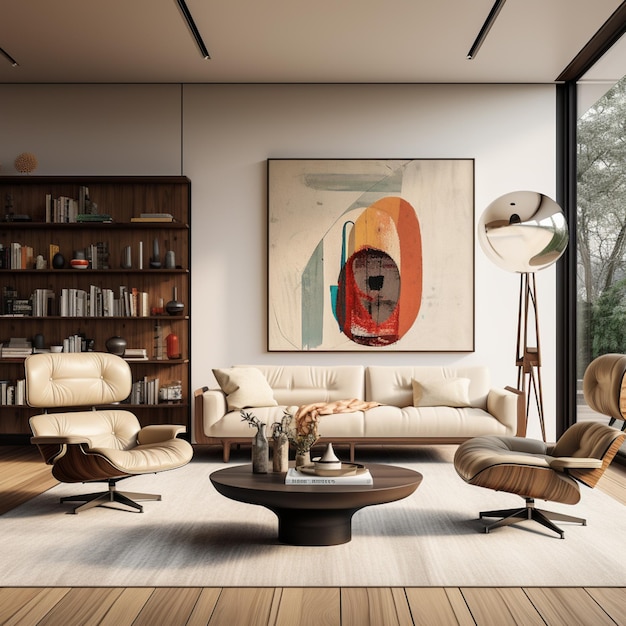
At what (x,y) coordinates should I click in order to perform the action: click on table. Please return your answer as a coordinate pair (x, y). Looking at the image, I should click on (345, 506).